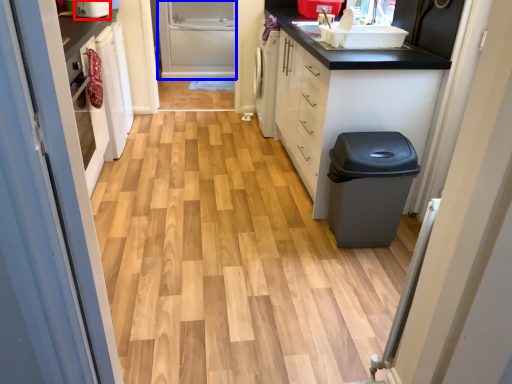
Question: Among these objects, which one is farthest to the camera, appliance (highlighted by a red box) or screen door (highlighted by a blue box)?

Choices:
 (A) appliance
 (B) screen door

Answer: (B)